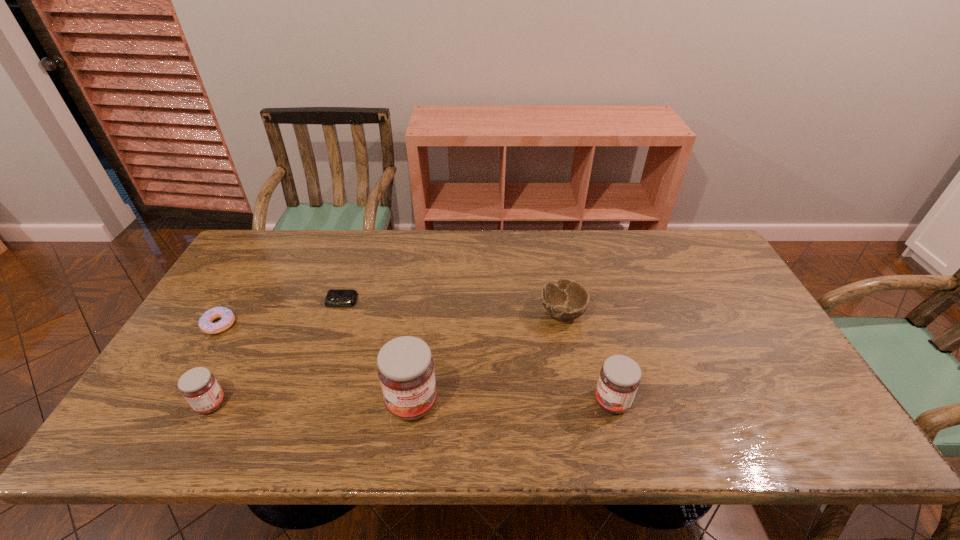
Find the location of a particular element. The width and height of the screenshot is (960, 540). the leftmost object is located at coordinates (227, 317).

The width and height of the screenshot is (960, 540). Find the location of `blank space located on the back of the fourth shortest object`. blank space located on the back of the fourth shortest object is located at coordinates (271, 291).

The width and height of the screenshot is (960, 540). I want to click on vacant space positioned on the back of the tallest jam, so click(420, 335).

This screenshot has height=540, width=960. Identify the location of blank area located 0.380m on the left of the second shortest jam. (434, 401).

Where is `free spot located on the right of the third shortest object`? The width and height of the screenshot is (960, 540). free spot located on the right of the third shortest object is located at coordinates (627, 313).

Locate an element on the screen. This screenshot has height=540, width=960. vacant space located on the display of the shortest object is located at coordinates (323, 356).

Where is `blank space located on the back of the leftmost object`? The height and width of the screenshot is (540, 960). blank space located on the back of the leftmost object is located at coordinates (255, 265).

Find the location of a particular element. jam that is at the left edge is located at coordinates (199, 387).

I want to click on doughnut situated at the left edge, so click(x=227, y=317).

Image resolution: width=960 pixels, height=540 pixels. What are the coordinates of `object positioned at the near left corner` in the screenshot? It's located at (199, 387).